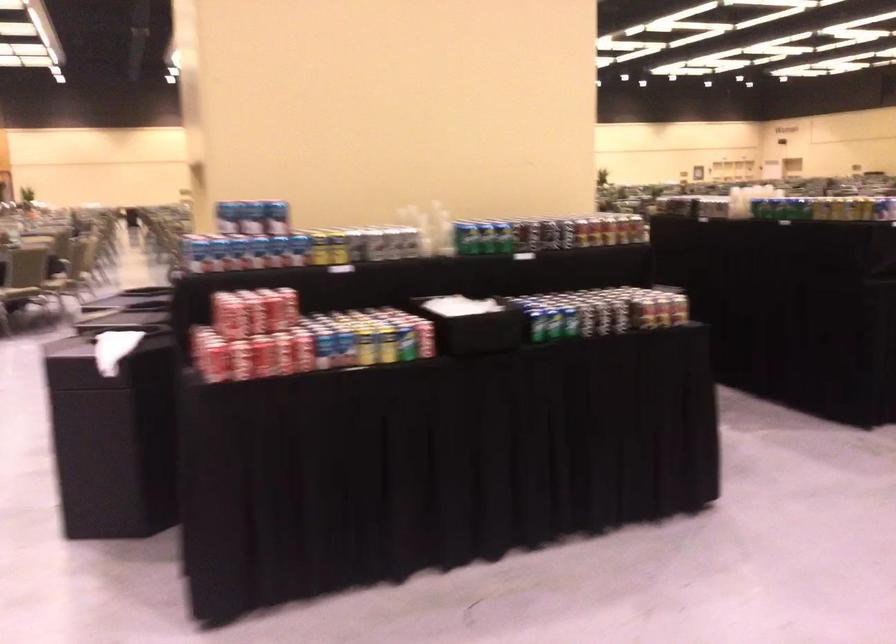
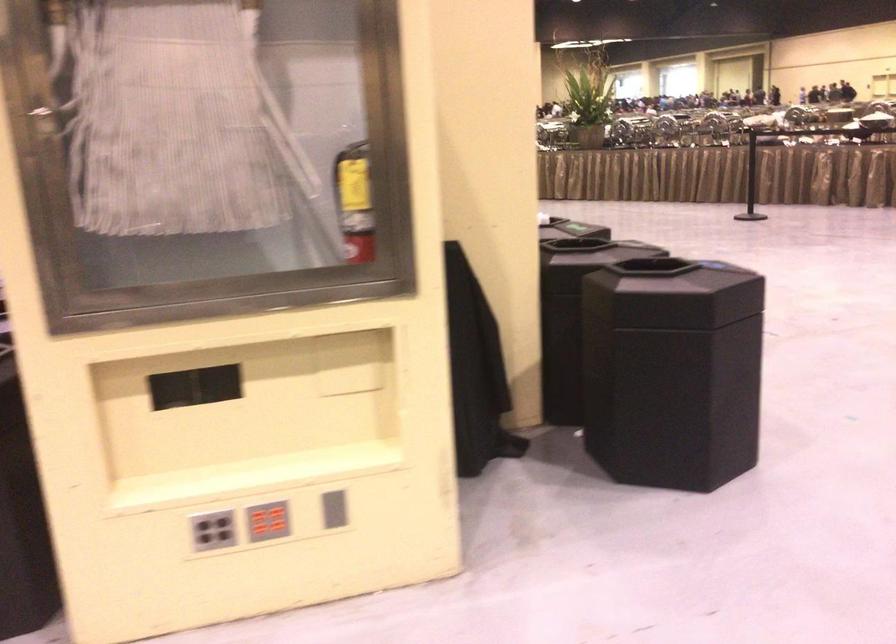
Question: I am providing you with two images of the same scene from different viewpoints. After the viewpoint changes to image2, which objects are now occluded?

Choices:
 (A) small juice bottle
 (B) blue soda can
 (C) black trash can lid
 (D) grey vertical slot

Answer: (B)